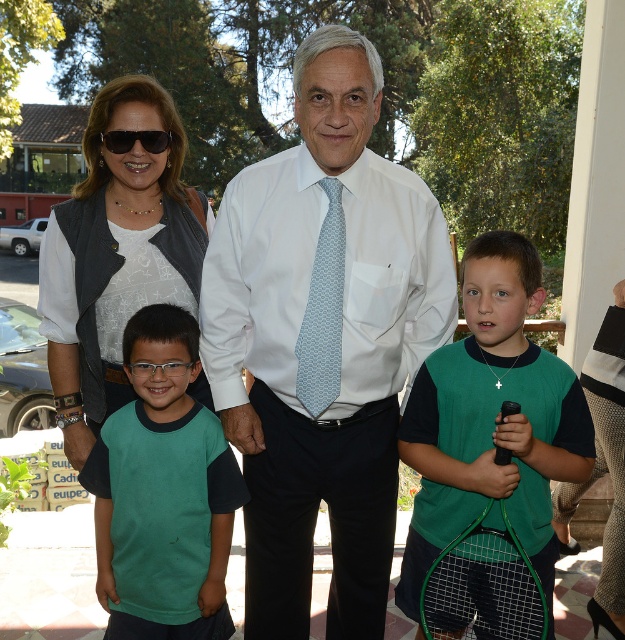
Question: Which object appears closest to the camera in this image?

Choices:
 (A) black plastic sunglasses at upper left
 (B) light blue textured tie at center
 (C) white silk shirt at center
 (D) green jersey at center

Answer: (C)

Question: Which object is positioned closest to the green jersey at center?

Choices:
 (A) white silk shirt at center
 (B) black plastic sunglasses at upper left
 (C) green mesh tennis racket at lower center

Answer: (C)

Question: Does green matte t-shirt at center lie behind green mesh tennis racket at lower center?

Choices:
 (A) no
 (B) yes

Answer: (B)

Question: Can you confirm if matte black vest at left is positioned to the right of green mesh tennis racket at lower center?

Choices:
 (A) yes
 (B) no

Answer: (B)

Question: Which object is closer to the camera taking this photo?

Choices:
 (A) green jersey at center
 (B) white silk shirt at center
 (C) light blue textured tie at center
 (D) green mesh tennis racket at lower center

Answer: (D)

Question: Is green jersey at center above green mesh tennis racket at lower center?

Choices:
 (A) no
 (B) yes

Answer: (B)